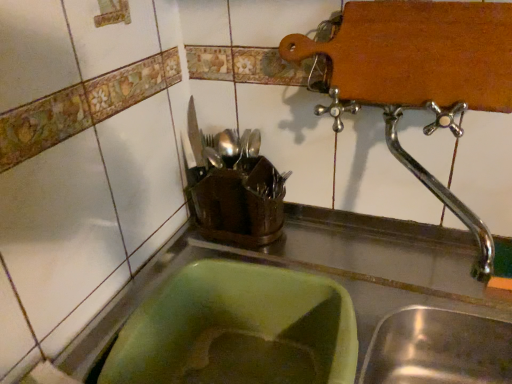
Question: Can you confirm if polished chrome tap at upper right is shorter than green plastic sink at lower left?

Choices:
 (A) yes
 (B) no

Answer: (A)

Question: Is the position of polished chrome tap at upper right more distant than that of green plastic sink at lower left?

Choices:
 (A) no
 (B) yes

Answer: (B)

Question: Would you consider polished chrome tap at upper right to be distant from green plastic sink at lower left?

Choices:
 (A) yes
 (B) no

Answer: (B)

Question: Can you confirm if polished chrome tap at upper right is positioned to the right of green plastic sink at lower left?

Choices:
 (A) yes
 (B) no

Answer: (A)

Question: Can you confirm if polished chrome tap at upper right is thinner than green plastic sink at lower left?

Choices:
 (A) no
 (B) yes

Answer: (B)

Question: From a real-world perspective, is metallic knife at upper center, marked as the 1th tableware in a left-to-right arrangement, positioned above or below green plastic sink at lower left?

Choices:
 (A) below
 (B) above

Answer: (B)

Question: Is point (190, 107) positioned closer to the camera than point (318, 211)?

Choices:
 (A) closer
 (B) farther

Answer: (A)

Question: Based on their positions, is metallic knife at upper center, which ranks as the 2th tableware in right-to-left order, located to the left or right of green plastic sink at lower left?

Choices:
 (A) right
 (B) left

Answer: (B)

Question: Relative to green plastic sink at lower left, is metallic knife at upper center, which ranks as the 2th tableware in right-to-left order, in front or behind?

Choices:
 (A) front
 (B) behind

Answer: (B)

Question: Considering the positions of polished chrome tap at upper right and green plastic sink at lower left in the image, is polished chrome tap at upper right taller or shorter than green plastic sink at lower left?

Choices:
 (A) tall
 (B) short

Answer: (B)

Question: Is polished chrome tap at upper right inside the boundaries of green plastic sink at lower left, or outside?

Choices:
 (A) outside
 (B) inside

Answer: (A)

Question: Based on their sizes in the image, would you say polished chrome tap at upper right is bigger or smaller than green plastic sink at lower left?

Choices:
 (A) big
 (B) small

Answer: (B)

Question: From a real-world perspective, is polished chrome tap at upper right physically located above or below green plastic sink at lower left?

Choices:
 (A) above
 (B) below

Answer: (A)

Question: Do you think shiny silver cutlery at center, marked as the 2th tableware in a left-to-right arrangement, is within green plastic sink at lower left, or outside of it?

Choices:
 (A) inside
 (B) outside

Answer: (B)

Question: Is point (231, 140) positioned closer to the camera than point (94, 354)?

Choices:
 (A) closer
 (B) farther

Answer: (B)